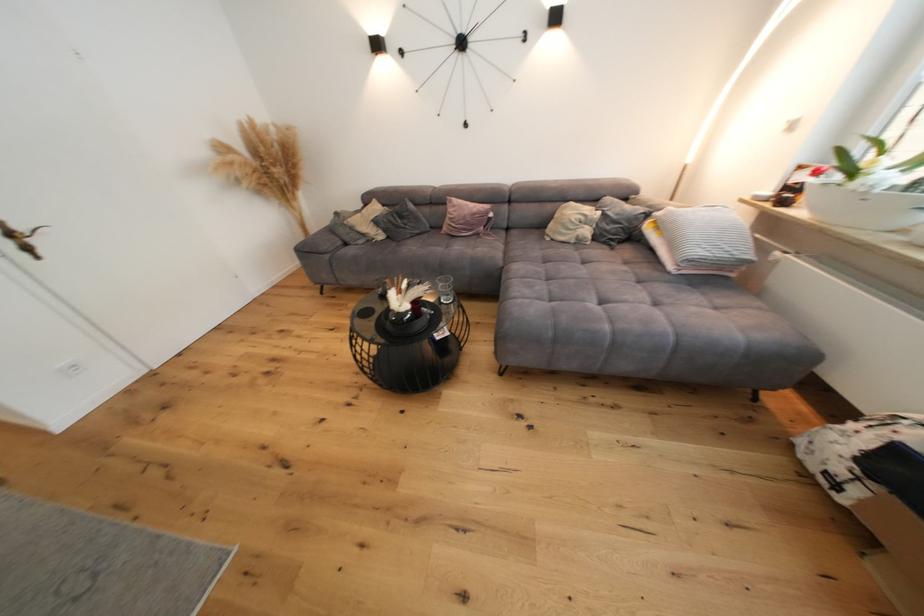
Locate an element on the screen. The width and height of the screenshot is (924, 616). clear drinking glass is located at coordinates (444, 290).